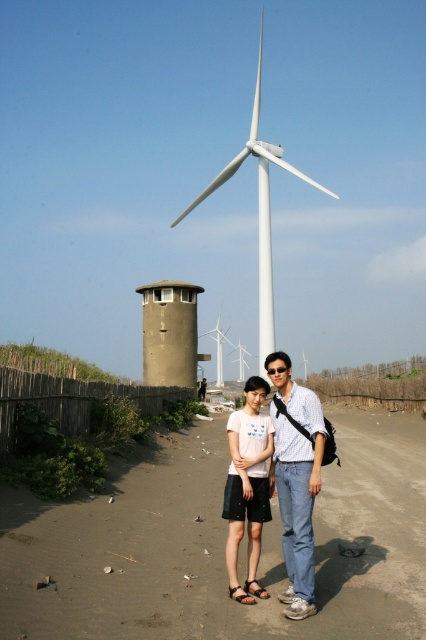
Question: In this image, where is denim jeans at center located relative to white matte wind turbine at center?

Choices:
 (A) right
 (B) left

Answer: (B)

Question: Which object appears closest to the camera in this image?

Choices:
 (A) white matte windmill at center
 (B) light pink cotton t-shirt at center

Answer: (B)

Question: Among these objects, which one is farthest from the camera?

Choices:
 (A) white matte wind turbine at center
 (B) light pink cotton t-shirt at center

Answer: (A)

Question: In this image, where is denim jeans at center located relative to light pink cotton t-shirt at center?

Choices:
 (A) below
 (B) above

Answer: (B)

Question: Which object is positioned closest to the denim jeans at center?

Choices:
 (A) light pink cotton t-shirt at center
 (B) white matte windmill at center

Answer: (A)

Question: Is denim jeans at center positioned in front of white matte windmill at center?

Choices:
 (A) no
 (B) yes

Answer: (B)